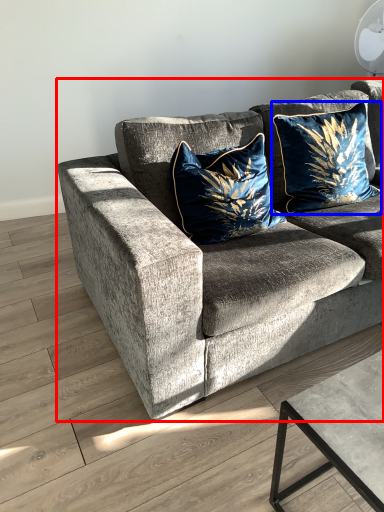
Question: Which object is further to the camera taking this photo, studio couch (highlighted by a red box) or pillow (highlighted by a blue box)?

Choices:
 (A) studio couch
 (B) pillow

Answer: (B)